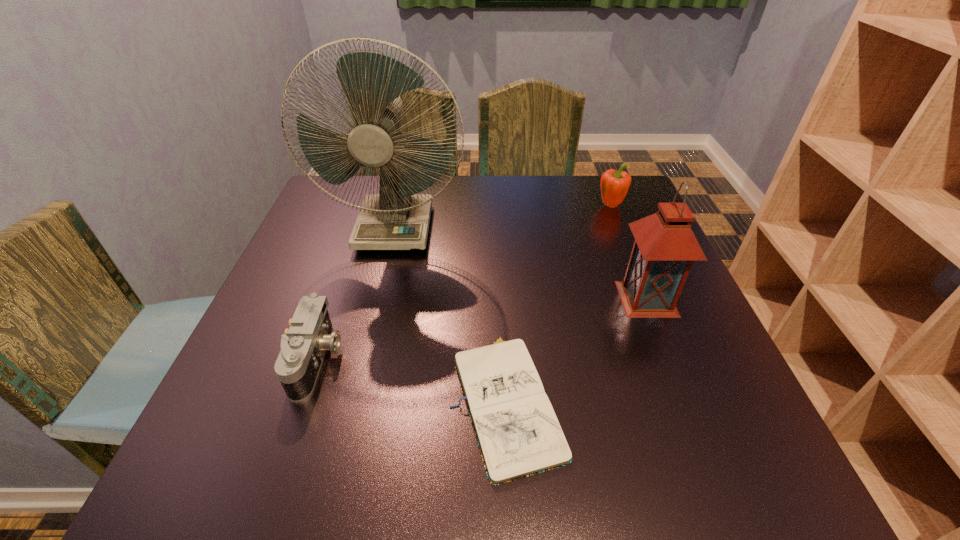
Find the location of a particular element. vacant space located on the back of the notebook is located at coordinates (497, 225).

The image size is (960, 540). I want to click on fan present at the far edge, so click(397, 218).

The image size is (960, 540). What are the coordinates of `pepper situated at the far edge` in the screenshot? It's located at [x=614, y=185].

Identify the location of object that is at the near edge. (517, 431).

Locate an element on the screen. This screenshot has width=960, height=540. fan present at the left edge is located at coordinates (397, 218).

At what (x,y) coordinates should I click in order to perform the action: click on camera positioned at the left edge. Please return your answer as a coordinate pair (x, y). Looking at the image, I should click on (303, 346).

This screenshot has height=540, width=960. In order to click on lantern present at the right edge in this screenshot , I will do 665,247.

Find the location of a particular element. This screenshot has height=540, width=960. pepper present at the right edge is located at coordinates (614, 185).

In order to click on object situated at the far left corner in this screenshot , I will do `click(397, 218)`.

Find the location of a particular element. The image size is (960, 540). object positioned at the far right corner is located at coordinates (614, 185).